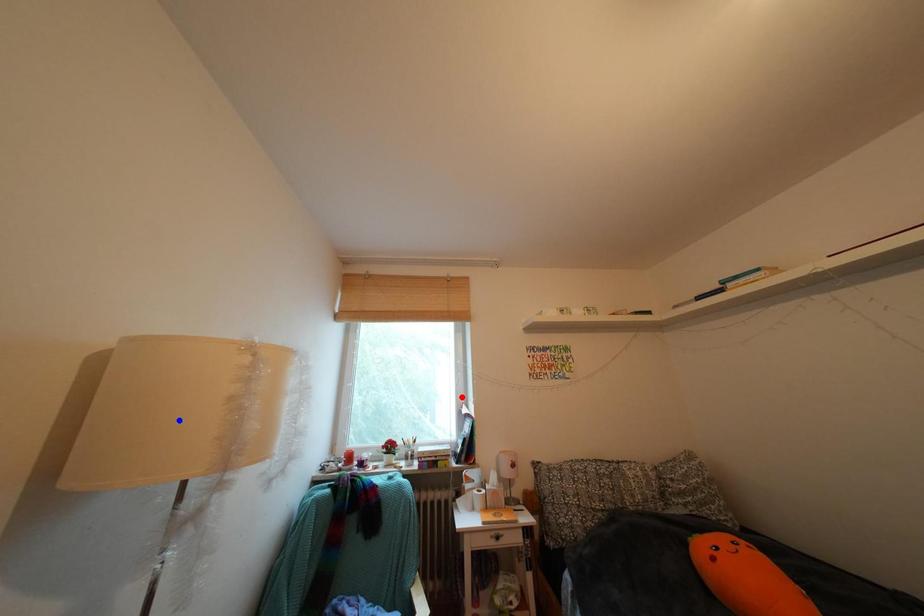
Question: In the image, two points are highlighted. Which point is nearer to the camera? Reply with the corresponding letter.

Choices:
 (A) blue point
 (B) red point

Answer: (A)